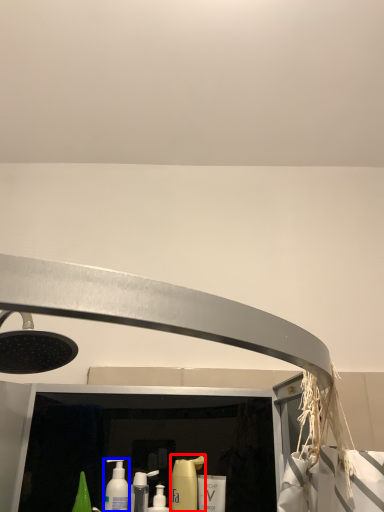
Question: Among these objects, which one is nearest to the camera, cleaning product (highlighted by a red box) or mouthwash (highlighted by a blue box)?

Choices:
 (A) cleaning product
 (B) mouthwash

Answer: (B)